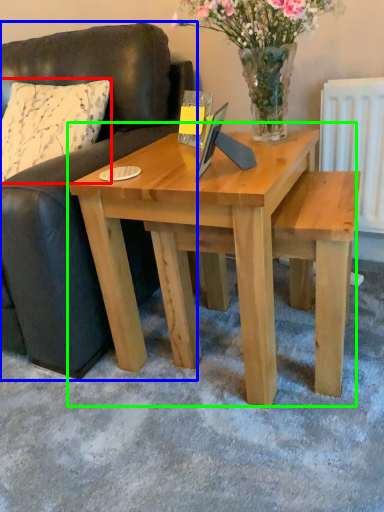
Question: Which object is positioned farthest from pillow (highlighted by a red box)? Select from studio couch (highlighted by a blue box) and coffee table (highlighted by a green box).

Choices:
 (A) studio couch
 (B) coffee table

Answer: (B)